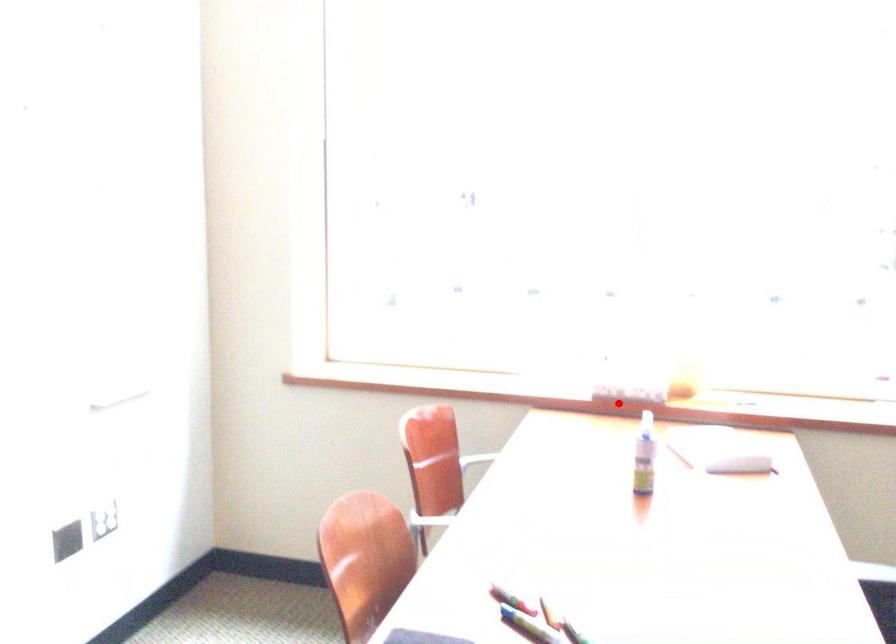
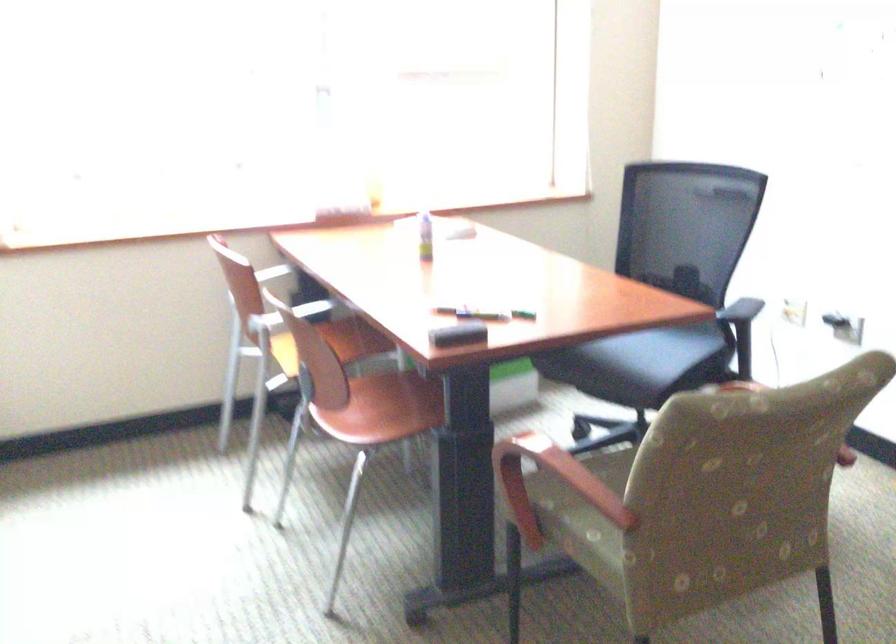
Question: I am providing you with two images of the same scene from different viewpoints. A red point is marked on the first image. At the location where the point appears in image 1, is it still visible in image 2?

Choices:
 (A) Yes
 (B) No

Answer: (A)